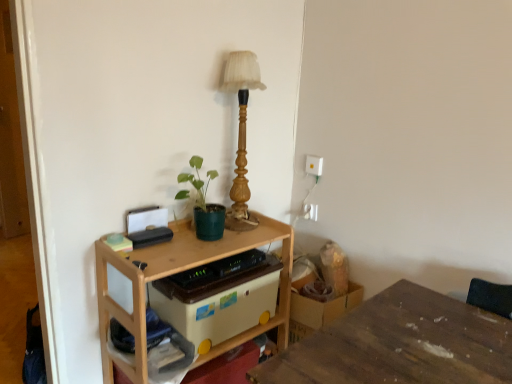
How much space does white plastic electric outlet at upper right, the 2th electric outlet from the top, occupy vertically?

white plastic electric outlet at upper right, the 2th electric outlet from the top, is 3.71 inches in height.

In order to face wooden table at center, arranged as the 2th table when viewed from the right, should I rotate leftwards or rightwards?

To face it directly, rotate left by 7.010 degrees.

The width and height of the screenshot is (512, 384). What do you see at coordinates (314, 165) in the screenshot? I see `white plastic electric outlet at upper right, the 2th electric outlet from the bottom` at bounding box center [314, 165].

Locate an element on the screen. white plastic electric outlet at upper right, the 2th electric outlet from the bottom is located at coordinates (314, 165).

This screenshot has height=384, width=512. What do you see at coordinates (203, 203) in the screenshot?
I see `green matte plant at center` at bounding box center [203, 203].

Where is `wooden table at lower right, the 2th table viewed from the left`? This screenshot has height=384, width=512. wooden table at lower right, the 2th table viewed from the left is located at coordinates (400, 344).

Is white plastic electric outlet at upper right, the 2th electric outlet from the top, placed right next to beige plastic storage box at center?

There is a gap between white plastic electric outlet at upper right, the 2th electric outlet from the top, and beige plastic storage box at center.

Considering the positions of point (315, 210) and point (244, 259), is point (315, 210) closer or farther from the camera than point (244, 259)?

Point (315, 210) is farther from the camera than point (244, 259).

From a real-world perspective, does white plastic electric outlet at upper right, the first electric outlet ordered from the bottom, sit lower than beige plastic storage box at center?

No, from a real-world perspective, white plastic electric outlet at upper right, the first electric outlet ordered from the bottom, is not below beige plastic storage box at center.

In order to click on storage box in front of the white plastic electric outlet at upper right, the 2th electric outlet from the top in this screenshot , I will do `click(218, 297)`.

Is wooden table at center, the first table positioned from the left, positioned with its back to wooden table lamp at upper center?

No, wooden table at center, the first table positioned from the left, is not facing the opposite direction of wooden table lamp at upper center.

Considering the positions of points (128, 376) and (241, 65), is point (128, 376) closer to camera compared to point (241, 65)?

Yes, it is in front of point (241, 65).

Is wooden table at center, arranged as the 2th table when viewed from the right, inside the boundaries of wooden table lamp at upper center, or outside?

The correct answer is: outside.

Which object is further away from the camera taking this photo, wooden table at center, the first table positioned from the left, or wooden table lamp at upper center?

Positioned behind is wooden table lamp at upper center.

Which point is more distant from viewer, [228,289] or [245,178]?

The point [245,178] is more distant.

Is beige plastic storage box at center turned away from wooden table lamp at upper center?

That's not correct — beige plastic storage box at center is not looking away from wooden table lamp at upper center.

From their relative heights in the image, would you say beige plastic storage box at center is taller or shorter than wooden table lamp at upper center?

beige plastic storage box at center is shorter than wooden table lamp at upper center.

Looking at their sizes, would you say white plastic electric outlet at upper right, the 2th electric outlet from the bottom, is wider or thinner than white plastic electric outlet at upper right, the first electric outlet ordered from the bottom?

Clearly, white plastic electric outlet at upper right, the 2th electric outlet from the bottom, has more width compared to white plastic electric outlet at upper right, the first electric outlet ordered from the bottom.

Are white plastic electric outlet at upper right, the 2th electric outlet from the bottom, and white plastic electric outlet at upper right, the 2th electric outlet from the top, far apart?

That's not correct — white plastic electric outlet at upper right, the 2th electric outlet from the bottom, is a little close to white plastic electric outlet at upper right, the 2th electric outlet from the top.

Is white plastic electric outlet at upper right, the first electric outlet ordered from the bottom, at the back of white plastic electric outlet at upper right, which ranks as the 1th electric outlet in top-to-bottom order?

white plastic electric outlet at upper right, which ranks as the 1th electric outlet in top-to-bottom order, is not turned away from white plastic electric outlet at upper right, the first electric outlet ordered from the bottom.

From the image's perspective, who appears lower, wooden table at center, arranged as the 2th table when viewed from the right, or green matte plant at center?

From the image's view, wooden table at center, arranged as the 2th table when viewed from the right, is below.

This screenshot has width=512, height=384. I want to click on houseplant that appears behind the wooden table at center, the first table positioned from the left, so click(x=203, y=203).

Is wooden table at center, the first table positioned from the left, in front of or behind green matte plant at center in the image?

Clearly, wooden table at center, the first table positioned from the left, is in front of green matte plant at center.

Locate an element on the screen. This screenshot has width=512, height=384. table above the wooden table at center, the first table positioned from the left (from the image's perspective) is located at coordinates (400, 344).

From a real-world perspective, who is located higher, wooden table at lower right, the 2th table viewed from the left, or wooden table at center, the first table positioned from the left?

wooden table at lower right, the 2th table viewed from the left, is physically above.

From the image's perspective, who appears lower, beige plastic storage box at center or wooden table at lower right, the 2th table viewed from the left?

wooden table at lower right, the 2th table viewed from the left.

This screenshot has height=384, width=512. What are the coordinates of `the 2nd table in front of the beige plastic storage box at center, starting your count from the anchor` in the screenshot? It's located at (400, 344).

From a real-world perspective, does beige plastic storage box at center sit lower than wooden table at lower right, the 2th table viewed from the left?

No, from a real-world perspective, beige plastic storage box at center is not below wooden table at lower right, the 2th table viewed from the left.

The image size is (512, 384). What are the coordinates of `storage box in front of the white plastic electric outlet at upper right, the 2th electric outlet from the top` in the screenshot? It's located at (218, 297).

The width and height of the screenshot is (512, 384). In order to click on table lamp on the right of wooden table at center, arranged as the 2th table when viewed from the right in this screenshot , I will do `click(241, 134)`.

Which object lies nearer to the anchor point wooden table at lower right, the 2th table viewed from the left, wooden table at center, arranged as the 2th table when viewed from the right, or white plastic electric outlet at upper right, the 2th electric outlet from the bottom?

wooden table at center, arranged as the 2th table when viewed from the right.

Based on their spatial positions, is wooden table at lower right, the 2th table viewed from the left, or white plastic electric outlet at upper right, which ranks as the 1th electric outlet in top-to-bottom order, further from green matte plant at center?

The object further to green matte plant at center is wooden table at lower right, the 2th table viewed from the left.

Estimate the real-world distances between objects in this image. Which object is closer to white plastic electric outlet at upper right, which ranks as the 1th electric outlet in top-to-bottom order, green matte plant at center or wooden table at center, the first table positioned from the left?

green matte plant at center lies closer to white plastic electric outlet at upper right, which ranks as the 1th electric outlet in top-to-bottom order, than the other object.

Estimate the real-world distances between objects in this image. Which object is further from wooden table at center, the first table positioned from the left, beige plastic storage box at center or white plastic electric outlet at upper right, which ranks as the 1th electric outlet in top-to-bottom order?

The object further to wooden table at center, the first table positioned from the left, is white plastic electric outlet at upper right, which ranks as the 1th electric outlet in top-to-bottom order.

Looking at the image, which one is located further to white plastic electric outlet at upper right, the 2th electric outlet from the top, white plastic electric outlet at upper right, which ranks as the 1th electric outlet in top-to-bottom order, or wooden table at lower right, the 2th table viewed from the left?

wooden table at lower right, the 2th table viewed from the left, is further to white plastic electric outlet at upper right, the 2th electric outlet from the top.

From the image, which object appears to be farther from white plastic electric outlet at upper right, which ranks as the 1th electric outlet in top-to-bottom order, white plastic electric outlet at upper right, the first electric outlet ordered from the bottom, or green matte plant at center?

The object further to white plastic electric outlet at upper right, which ranks as the 1th electric outlet in top-to-bottom order, is green matte plant at center.

When comparing their distances from wooden table at lower right, the 2th table viewed from the left, does beige plastic storage box at center or white plastic electric outlet at upper right, the 2th electric outlet from the top, seem closer?

Among the two, beige plastic storage box at center is located nearer to wooden table at lower right, the 2th table viewed from the left.

Estimate the real-world distances between objects in this image. Which object is closer to white plastic electric outlet at upper right, which ranks as the 1th electric outlet in top-to-bottom order, wooden table at lower right, the 2th table viewed from the left, or white plastic electric outlet at upper right, the 2th electric outlet from the top?

white plastic electric outlet at upper right, the 2th electric outlet from the top, is closer to white plastic electric outlet at upper right, which ranks as the 1th electric outlet in top-to-bottom order.

Identify the location of electric outlet positioned between wooden table at lower right, the 2th table viewed from the left, and white plastic electric outlet at upper right, the 2th electric outlet from the top, from near to far. The image size is (512, 384). (314, 165).

The height and width of the screenshot is (384, 512). Find the location of `houseplant between wooden table lamp at upper center and beige plastic storage box at center vertically`. houseplant between wooden table lamp at upper center and beige plastic storage box at center vertically is located at coordinates (203, 203).

The width and height of the screenshot is (512, 384). Find the location of `table lamp between wooden table at center, the first table positioned from the left, and white plastic electric outlet at upper right, the 2th electric outlet from the top, in the front-back direction`. table lamp between wooden table at center, the first table positioned from the left, and white plastic electric outlet at upper right, the 2th electric outlet from the top, in the front-back direction is located at coordinates (241, 134).

The height and width of the screenshot is (384, 512). What are the coordinates of `houseplant positioned between wooden table at lower right, positioned as the first table in right-to-left order, and white plastic electric outlet at upper right, the 2th electric outlet from the top, from near to far` in the screenshot? It's located at (203, 203).